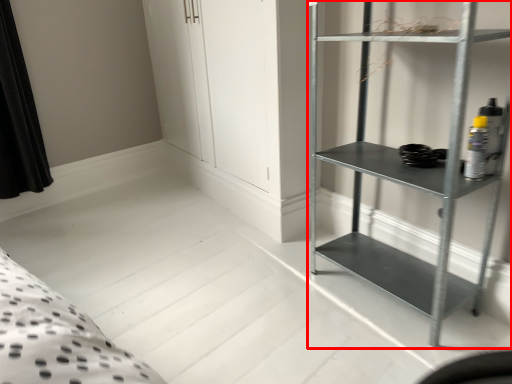
Question: From the image's perspective, where is shelf (annotated by the red box) located relative to cabinet?

Choices:
 (A) above
 (B) below

Answer: (A)